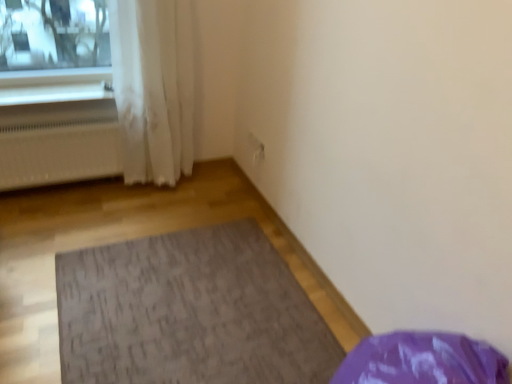
Where is `vacant area that lies between white sheer curtain at left and textured gray mat at center`? vacant area that lies between white sheer curtain at left and textured gray mat at center is located at coordinates (153, 209).